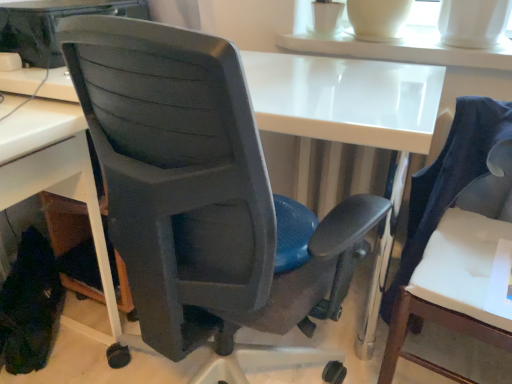
Identify the location of white glossy table at upper center. (402, 49).

How much space does matte plastic chair at center, marked as the second chair in a right-to-left arrangement, occupy horizontally?

The width of matte plastic chair at center, marked as the second chair in a right-to-left arrangement, is 25.40 inches.

Locate an element on the screen. This screenshot has width=512, height=384. white plastic desk at lower left is located at coordinates (53, 170).

You are a GUI agent. You are given a task and a screenshot of the screen. Output one action in this format:
    pyautogui.click(x=<x>, y=<y>)
    Task: Click on the white glossy table at upper center
    This screenshot has height=384, width=512.
    Given the screenshot: What is the action you would take?
    pyautogui.click(x=402, y=49)

Is point (120, 166) farther from camera compared to point (44, 168)?

No, (120, 166) is in front of (44, 168).

Would you say matte plastic chair at center, marked as the second chair in a right-to-left arrangement, is outside white plastic desk at lower left?

That's correct, matte plastic chair at center, marked as the second chair in a right-to-left arrangement, is outside of white plastic desk at lower left.

Can you tell me how much matte plastic chair at center, the first chair from the left, and white plastic desk at lower left differ in facing direction?

They differ by 90.5 degrees in their facing directions.

Is matte plastic chair at center, marked as the second chair in a right-to-left arrangement, with white plastic desk at lower left?

matte plastic chair at center, marked as the second chair in a right-to-left arrangement, and white plastic desk at lower left are not in contact.

Considering the sizes of white fabric chair at right, the 1th chair viewed from the right, and matte plastic chair at center, marked as the second chair in a right-to-left arrangement, in the image, is white fabric chair at right, the 1th chair viewed from the right, taller or shorter than matte plastic chair at center, marked as the second chair in a right-to-left arrangement,?

Clearly, white fabric chair at right, the 1th chair viewed from the right, is shorter compared to matte plastic chair at center, marked as the second chair in a right-to-left arrangement.

Which object is further away from the camera taking this photo, white fabric chair at right, the 1th chair viewed from the right, or matte plastic chair at center, marked as the second chair in a right-to-left arrangement?

Positioned behind is white fabric chair at right, the 1th chair viewed from the right.

From a real-world perspective, is white fabric chair at right, the 1th chair viewed from the right, physically below matte plastic chair at center, the first chair from the left?

Yes, from a real-world perspective, white fabric chair at right, the 1th chair viewed from the right, is beneath matte plastic chair at center, the first chair from the left.

Find the location of a particular element. This screenshot has width=512, height=384. chair behind the matte plastic chair at center, marked as the second chair in a right-to-left arrangement is located at coordinates (448, 179).

Does white plastic desk at lower left turn towards white fabric chair at right, arranged as the 2th chair when viewed from the left?

No.

From a real-world perspective, is white plastic desk at lower left over white fabric chair at right, the 1th chair viewed from the right?

No.

Is white plastic desk at lower left next to white fabric chair at right, arranged as the 2th chair when viewed from the left, and touching it?

No, white plastic desk at lower left is not in contact with white fabric chair at right, arranged as the 2th chair when viewed from the left.

Between point (95, 206) and point (488, 138), which one is positioned in front?

The point (488, 138) is closer to the camera.

Considering the relative positions of white fabric chair at right, arranged as the 2th chair when viewed from the left, and white glossy table at upper center in the image provided, is white fabric chair at right, arranged as the 2th chair when viewed from the left, to the right of white glossy table at upper center from the viewer's perspective?

Yes, white fabric chair at right, arranged as the 2th chair when viewed from the left, is to the right of white glossy table at upper center.

Does white fabric chair at right, arranged as the 2th chair when viewed from the left, have a larger size compared to white glossy table at upper center?

Indeed, white fabric chair at right, arranged as the 2th chair when viewed from the left, has a larger size compared to white glossy table at upper center.

Consider the image. Could you tell me if white fabric chair at right, the 1th chair viewed from the right, is turned towards white glossy table at upper center?

No, white fabric chair at right, the 1th chair viewed from the right, does not turn towards white glossy table at upper center.

Considering the relative sizes of white fabric chair at right, the 1th chair viewed from the right, and white glossy table at upper center in the image provided, is white fabric chair at right, the 1th chair viewed from the right, taller than white glossy table at upper center?

Yes, white fabric chair at right, the 1th chair viewed from the right, is taller than white glossy table at upper center.

Does point (370, 54) appear closer or farther from the camera than point (339, 222)?

Point (370, 54) appears to be farther away from the viewer than point (339, 222).

Would you say white glossy table at upper center is outside matte plastic chair at center, the first chair from the left?

Yes.

Consider the image. From a real-world perspective, relative to matte plastic chair at center, marked as the second chair in a right-to-left arrangement, is white glossy table at upper center vertically above or below?

From a real-world perspective, white glossy table at upper center is physically above matte plastic chair at center, marked as the second chair in a right-to-left arrangement.

From the picture: Is white glossy table at upper center facing towards white fabric chair at right, the 1th chair viewed from the right?

No, white glossy table at upper center is not turned towards white fabric chair at right, the 1th chair viewed from the right.

Are white glossy table at upper center and white fabric chair at right, arranged as the 2th chair when viewed from the left, making contact?

No, white glossy table at upper center is not next to white fabric chair at right, arranged as the 2th chair when viewed from the left.

Which object is further away from the camera, white glossy table at upper center or white fabric chair at right, the 1th chair viewed from the right?

white glossy table at upper center is more distant.

Is white fabric chair at right, the 1th chair viewed from the right, taller or shorter than white plastic desk at lower left?

In the image, white fabric chair at right, the 1th chair viewed from the right, appears to be taller than white plastic desk at lower left.

Is white fabric chair at right, arranged as the 2th chair when viewed from the left, oriented towards white plastic desk at lower left?

No, white fabric chair at right, arranged as the 2th chair when viewed from the left, does not turn towards white plastic desk at lower left.

Considering the sizes of objects white fabric chair at right, the 1th chair viewed from the right, and white plastic desk at lower left in the image provided, who is wider, white fabric chair at right, the 1th chair viewed from the right, or white plastic desk at lower left?

white plastic desk at lower left is wider.

Is point (426, 213) closer or farther from the camera than point (71, 140)?

Clearly, point (426, 213) is more distant from the camera than point (71, 140).

Identify the location of desk on the left of the matte plastic chair at center, marked as the second chair in a right-to-left arrangement. (53, 170).

I want to click on chair that appears in front of the white fabric chair at right, the 1th chair viewed from the right, so click(x=202, y=191).

Looking at the image, which one is located closer to matte plastic chair at center, marked as the second chair in a right-to-left arrangement, white plastic desk at lower left or white fabric chair at right, the 1th chair viewed from the right?

Among the two, white plastic desk at lower left is located nearer to matte plastic chair at center, marked as the second chair in a right-to-left arrangement.

From the image, which object appears to be farther from matte plastic chair at center, the first chair from the left, white glossy table at upper center or white plastic desk at lower left?

Based on the image, white glossy table at upper center appears to be further to matte plastic chair at center, the first chair from the left.

From the image, which object appears to be farther from white fabric chair at right, arranged as the 2th chair when viewed from the left, white glossy table at upper center or matte plastic chair at center, marked as the second chair in a right-to-left arrangement?

matte plastic chair at center, marked as the second chair in a right-to-left arrangement, is positioned further to the anchor white fabric chair at right, arranged as the 2th chair when viewed from the left.

From the image, which object appears to be nearer to matte plastic chair at center, marked as the second chair in a right-to-left arrangement, white plastic desk at lower left or white glossy table at upper center?

white plastic desk at lower left is positioned closer to the anchor matte plastic chair at center, marked as the second chair in a right-to-left arrangement.

Estimate the real-world distances between objects in this image. Which object is closer to matte plastic chair at center, the first chair from the left, white fabric chair at right, the 1th chair viewed from the right, or white glossy table at upper center?

white fabric chair at right, the 1th chair viewed from the right, is positioned closer to the anchor matte plastic chair at center, the first chair from the left.

Based on their spatial positions, is white glossy table at upper center or white fabric chair at right, the 1th chair viewed from the right, further from white plastic desk at lower left?

white glossy table at upper center is further to white plastic desk at lower left.

In the scene shown: Estimate the real-world distances between objects in this image. Which object is closer to white fabric chair at right, arranged as the 2th chair when viewed from the left, white glossy table at upper center or white plastic desk at lower left?

white glossy table at upper center is positioned closer to the anchor white fabric chair at right, arranged as the 2th chair when viewed from the left.

Considering their positions, is matte plastic chair at center, marked as the second chair in a right-to-left arrangement, positioned further to white fabric chair at right, the 1th chair viewed from the right, than white plastic desk at lower left?

white plastic desk at lower left is further to white fabric chair at right, the 1th chair viewed from the right.

The width and height of the screenshot is (512, 384). I want to click on chair positioned between matte plastic chair at center, marked as the second chair in a right-to-left arrangement, and white glossy table at upper center from near to far, so click(448, 179).

Image resolution: width=512 pixels, height=384 pixels. I want to click on table situated between white plastic desk at lower left and white fabric chair at right, arranged as the 2th chair when viewed from the left, from left to right, so click(402, 49).

Where is `chair situated between white plastic desk at lower left and white glossy table at upper center from left to right`? chair situated between white plastic desk at lower left and white glossy table at upper center from left to right is located at coordinates [202, 191].

Locate an element on the screen. chair between white plastic desk at lower left and white fabric chair at right, the 1th chair viewed from the right, in the horizontal direction is located at coordinates (202, 191).